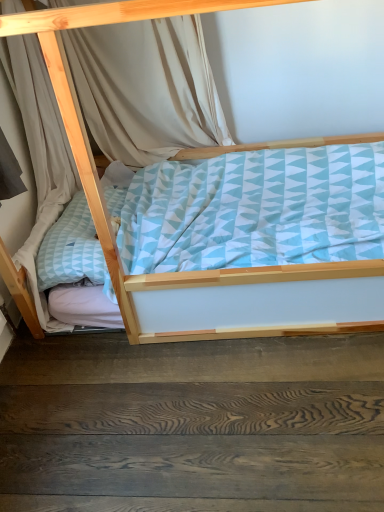
Question: Looking at their shapes, would you say dark wood floor at lower center is wider or thinner than beige fabric curtain at upper left?

Choices:
 (A) thin
 (B) wide

Answer: (B)

Question: Is dark wood floor at lower center taller or shorter than beige fabric curtain at upper left?

Choices:
 (A) short
 (B) tall

Answer: (A)

Question: Which object is positioned closest to the dark wood floor at lower center?

Choices:
 (A) beige fabric curtain at upper left
 (B) light blue fabric bed at center

Answer: (B)

Question: Estimate the real-world distances between objects in this image. Which object is closer to the beige fabric curtain at upper left?

Choices:
 (A) light blue fabric bed at center
 (B) dark wood floor at lower center

Answer: (A)